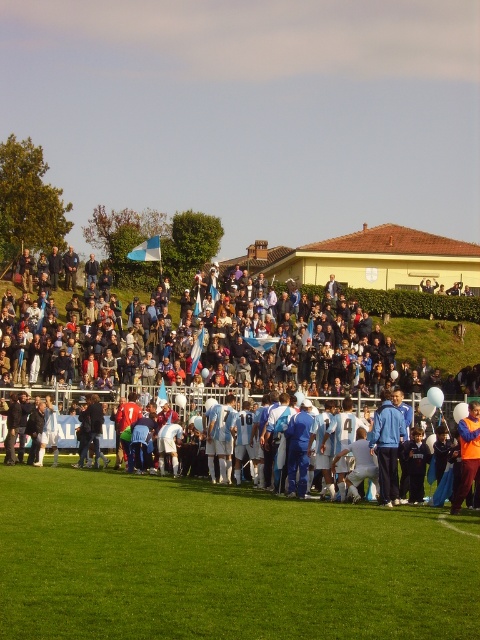
Is white matte soccer team at upper center below white matte soccer players at center?

Actually, white matte soccer team at upper center is above white matte soccer players at center.

Does point (418, 352) lie in front of point (72, 416)?

No.

Where is `white matte soccer team at upper center`? The height and width of the screenshot is (640, 480). white matte soccer team at upper center is located at coordinates (429, 330).

This screenshot has height=640, width=480. What are the coordinates of `green grass field at lower center` in the screenshot? It's located at (225, 563).

In the scene shown: Does green grass field at lower center have a smaller size compared to white matte soccer players at center?

Indeed, green grass field at lower center has a smaller size compared to white matte soccer players at center.

Does point (81, 573) come in front of point (1, 432)?

Yes, it is.

The image size is (480, 640). Identify the location of green grass field at lower center. [x=225, y=563].

Is green grass field at lower center above white matte soccer team at upper center?

Incorrect, green grass field at lower center is not positioned above white matte soccer team at upper center.

Can you confirm if green grass field at lower center is wider than white matte soccer team at upper center?

Incorrect, green grass field at lower center's width does not surpass white matte soccer team at upper center's.

Locate an element on the screen. green grass field at lower center is located at coordinates (225, 563).